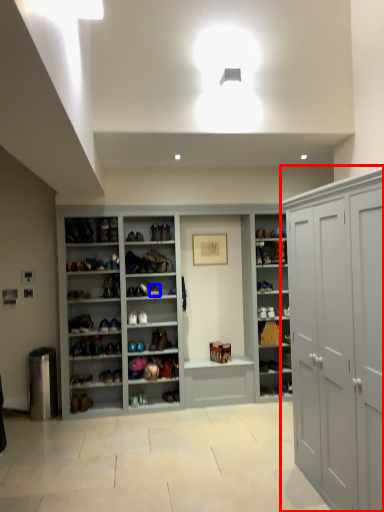
Question: Which object appears closest to the camera in this image, cabinetry (highlighted by a red box) or shoe (highlighted by a blue box)?

Choices:
 (A) cabinetry
 (B) shoe

Answer: (A)